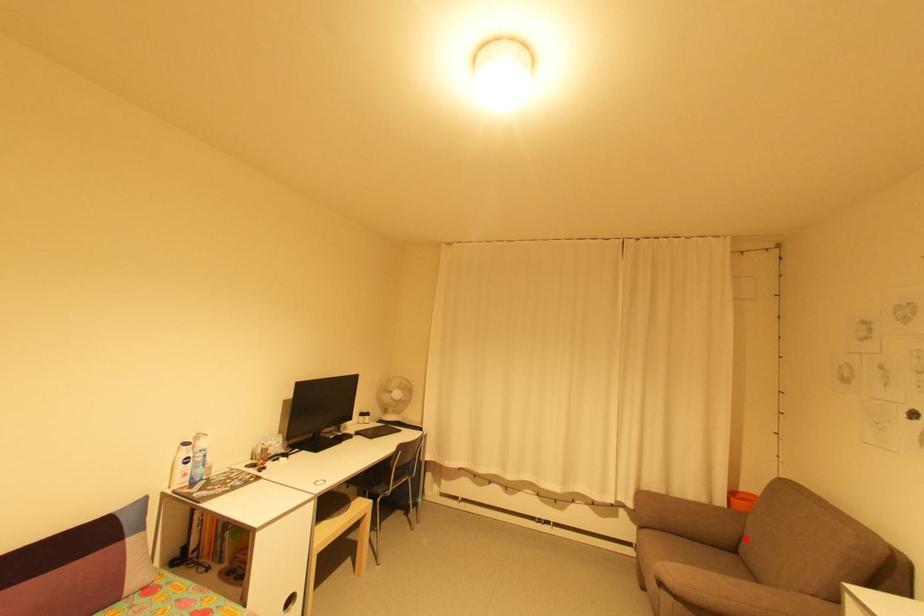
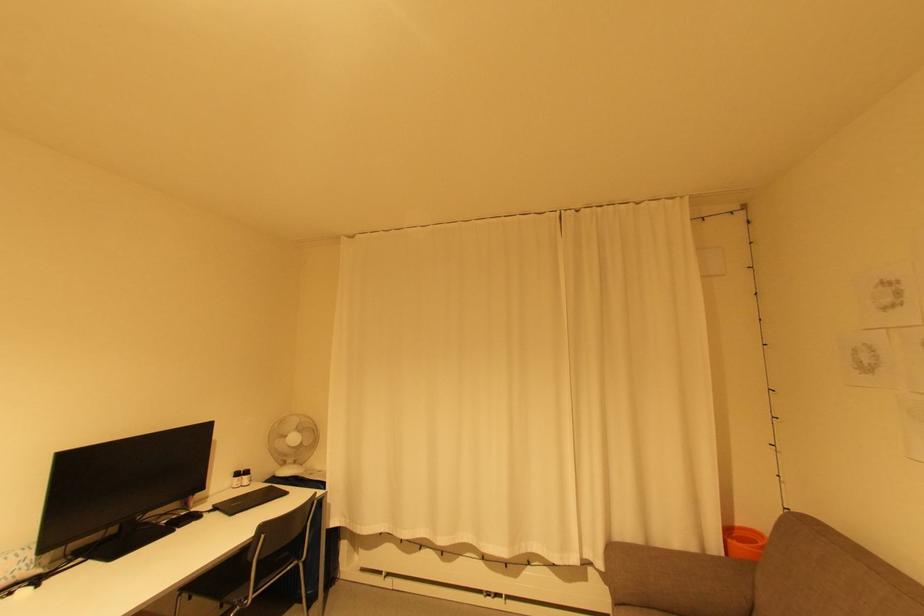
Question: I am providing you with two images of the same scene from different viewpoints. Given a red point in image1, look at the same physical point in image2. Is it:

Choices:
 (A) Closer to the viewpoint
 (B) Farther from the viewpoint

Answer: (B)